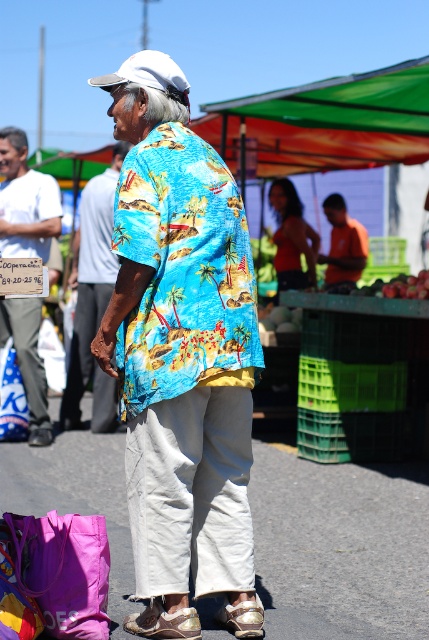
Between matte white signboard at left and shiny blue shirt at center, which one is positioned lower?

Positioned lower is shiny blue shirt at center.

Is matte white signboard at left above shiny blue shirt at center?

Yes, matte white signboard at left is above shiny blue shirt at center.

Does point (3, 163) come behind point (87, 182)?

No, (3, 163) is closer to viewer.

Locate an element on the screen. The image size is (429, 640). matte white signboard at left is located at coordinates (24, 202).

This screenshot has width=429, height=640. In order to click on green fabric canopy at upper center in this screenshot , I will do `click(325, 124)`.

Which of these two, green fabric canopy at upper center or matte white signboard at left, stands shorter?

Standing shorter between the two is green fabric canopy at upper center.

Which is behind, point (410, 118) or point (8, 193)?

Point (410, 118)

Image resolution: width=429 pixels, height=640 pixels. I want to click on green fabric canopy at upper center, so click(325, 124).

Is green fabric canopy at upper center further to the viewer compared to matte orange shirt at center?

That is False.

Does point (296, 141) lie in front of point (295, 262)?

Yes, point (296, 141) is in front of point (295, 262).

Is point (262, 163) in front of point (277, 180)?

Yes, it is.

Image resolution: width=429 pixels, height=640 pixels. I want to click on green fabric canopy at upper center, so click(325, 124).